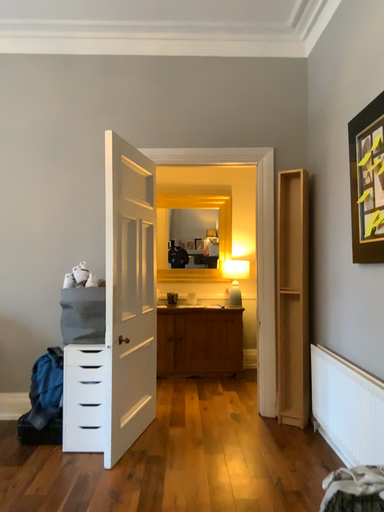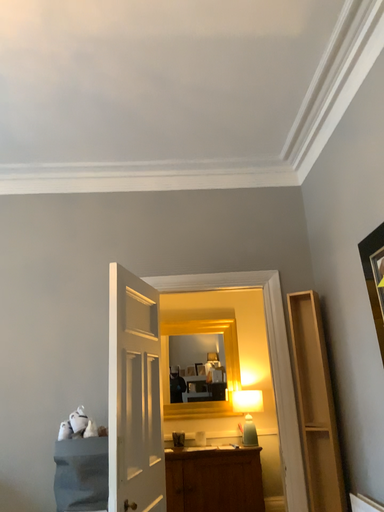
Question: How did the camera likely rotate when shooting the video?

Choices:
 (A) rotated upward
 (B) rotated downward

Answer: (A)